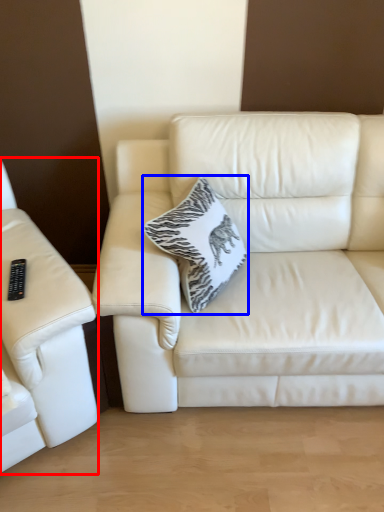
Question: Which object appears closest to the camera in this image, studio couch (highlighted by a red box) or throw pillow (highlighted by a blue box)?

Choices:
 (A) studio couch
 (B) throw pillow

Answer: (A)